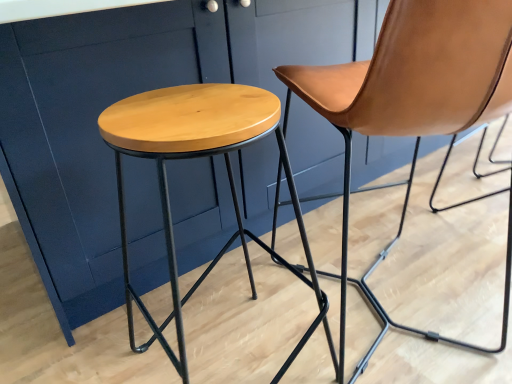
Locate an element on the screen. This screenshot has width=512, height=384. natural wood stool at center is located at coordinates (196, 157).

This screenshot has width=512, height=384. What do you see at coordinates (196, 157) in the screenshot?
I see `natural wood stool at center` at bounding box center [196, 157].

Find the location of a particular element. This screenshot has height=384, width=512. brown leather chair at center is located at coordinates (415, 103).

The image size is (512, 384). What do you see at coordinates (415, 103) in the screenshot?
I see `brown leather chair at center` at bounding box center [415, 103].

Locate an element on the screen. The width and height of the screenshot is (512, 384). natural wood stool at center is located at coordinates (196, 157).

Is brown leather chair at center to the left of natural wood stool at center from the viewer's perspective?

No, brown leather chair at center is not to the left of natural wood stool at center.

Which object is further away from the camera, brown leather chair at center or natural wood stool at center?

brown leather chair at center is further from the camera.

Is point (480, 33) closer or farther from the camera than point (180, 153)?

Point (480, 33) is positioned closer to the camera compared to point (180, 153).

From the image's perspective, relative to natural wood stool at center, is brown leather chair at center above or below?

Clearly, from the image's perspective, brown leather chair at center is above natural wood stool at center.

From a real-world perspective, who is located higher, brown leather chair at center or natural wood stool at center?

brown leather chair at center.

Is brown leather chair at center wider or thinner than natural wood stool at center?

In the image, brown leather chair at center appears to be wider than natural wood stool at center.

Considering the sizes of objects brown leather chair at center and natural wood stool at center in the image provided, who is shorter, brown leather chair at center or natural wood stool at center?

natural wood stool at center.

Which of these two, brown leather chair at center or natural wood stool at center, is smaller?

Smaller between the two is natural wood stool at center.

Is brown leather chair at center positioned beyond the bounds of natural wood stool at center?

That's correct, brown leather chair at center is outside of natural wood stool at center.

Are brown leather chair at center and natural wood stool at center beside each other?

No, brown leather chair at center is not in contact with natural wood stool at center.

Is natural wood stool at center at the back of brown leather chair at center?

brown leather chair at center does not have its back to natural wood stool at center.

In the scene shown: Can you tell me how much brown leather chair at center and natural wood stool at center differ in facing direction?

4.41 degrees.

How far apart are brown leather chair at center and natural wood stool at center?

27.78 centimeters.

You are a GUI agent. You are given a task and a screenshot of the screen. Output one action in this format:
    pyautogui.click(x=<x>, y=<y>)
    Task: Click on the stool directly beneath the brown leather chair at center (from a real-world perspective)
    Image resolution: width=512 pixels, height=384 pixels.
    Given the screenshot: What is the action you would take?
    pyautogui.click(x=196, y=157)

Is natural wood stool at center to the left or to the right of brown leather chair at center in the image?

Based on their positions, natural wood stool at center is located to the left of brown leather chair at center.

Based on the photo, between natural wood stool at center and brown leather chair at center, which one is positioned in front?

natural wood stool at center is in front.

Is point (190, 149) less distant than point (425, 61)?

Yes, point (190, 149) is closer to viewer.

From the image's perspective, which one is positioned higher, natural wood stool at center or brown leather chair at center?

brown leather chair at center, from the image's perspective.

From a real-world perspective, relative to brown leather chair at center, is natural wood stool at center vertically above or below?

Clearly, from a real-world perspective, natural wood stool at center is below brown leather chair at center.

Looking at their sizes, would you say natural wood stool at center is wider or thinner than brown leather chair at center?

Considering their sizes, natural wood stool at center looks slimmer than brown leather chair at center.

In terms of height, does natural wood stool at center look taller or shorter compared to brown leather chair at center?

In the image, natural wood stool at center appears to be shorter than brown leather chair at center.

Based on their sizes in the image, would you say natural wood stool at center is bigger or smaller than brown leather chair at center?

natural wood stool at center is smaller than brown leather chair at center.

Is natural wood stool at center situated inside brown leather chair at center or outside?

natural wood stool at center lies outside brown leather chair at center.

Is the surface of natural wood stool at center in direct contact with brown leather chair at center?

No, natural wood stool at center is not in contact with brown leather chair at center.

Is brown leather chair at center at the back of natural wood stool at center?

natural wood stool at center is not turned away from brown leather chair at center.

What's the angular difference between natural wood stool at center and brown leather chair at center's facing directions?

natural wood stool at center and brown leather chair at center are facing 4.41 degrees away from each other.

This screenshot has height=384, width=512. Identify the location of chair above the natural wood stool at center (from a real-world perspective). (415, 103).

Where is `chair that appears above the natural wood stool at center (from a real-world perspective)`? The image size is (512, 384). chair that appears above the natural wood stool at center (from a real-world perspective) is located at coordinates (415, 103).

This screenshot has width=512, height=384. I want to click on chair that appears behind the natural wood stool at center, so click(x=415, y=103).